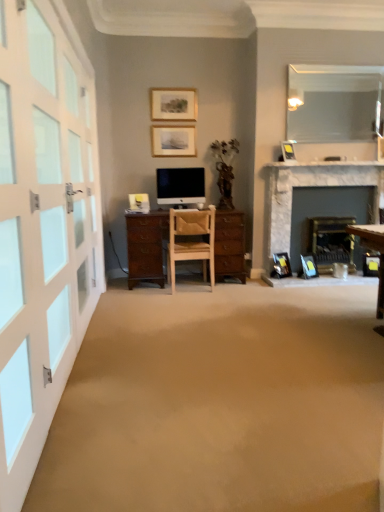
Where is `free space above matte wooden picture frame at upper center, which is counted as the 5th picture frame, starting from the bottom (from a real-world perspective)`? The width and height of the screenshot is (384, 512). free space above matte wooden picture frame at upper center, which is counted as the 5th picture frame, starting from the bottom (from a real-world perspective) is located at coordinates (180, 83).